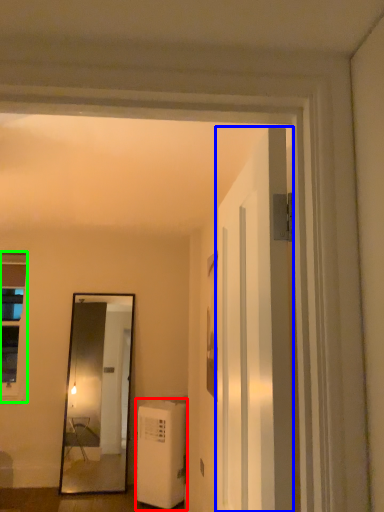
Question: Estimate the real-world distances between objects in this image. Which object is closer to air conditioner (highlighted by a red box), door (highlighted by a blue box) or window (highlighted by a green box)?

Choices:
 (A) door
 (B) window

Answer: (B)